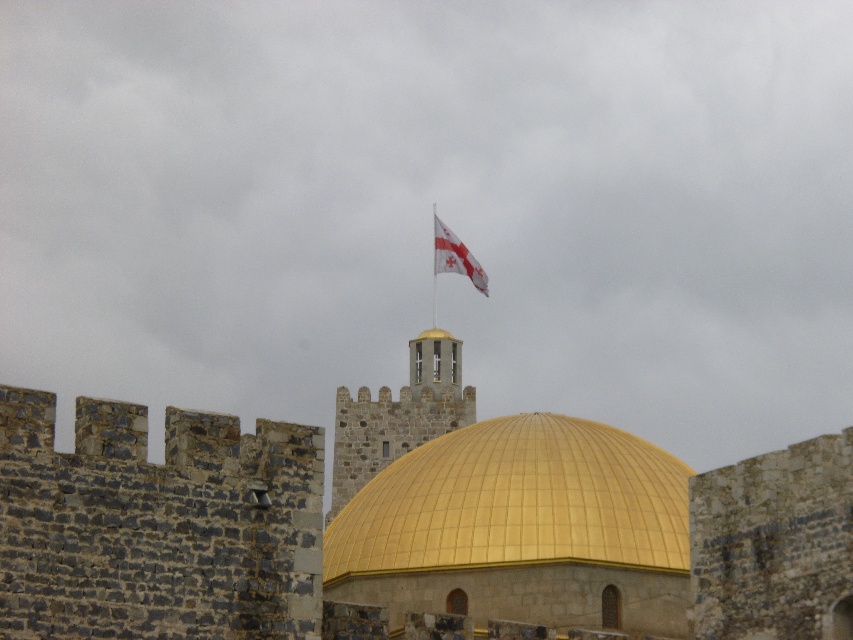
You are standing in front of the fortress wall and want to touch both the gold metallic dome at center and the white fabric flag at upper center. Which object will you reach first?

You will reach the gold metallic dome at center first because it is closer to you than the white fabric flag at upper center.

You are a tourist standing in front of the fortress. You see the gold metallic dome at center and the white fabric flag at upper center. Which object is positioned more to the right?

The white fabric flag at upper center is positioned more to the right than the gold metallic dome at center.